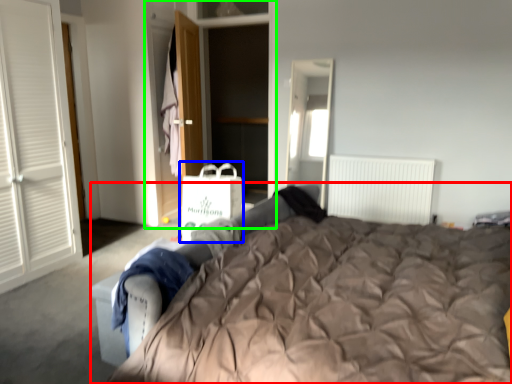
Question: Considering the real-world distances, which object is farthest from bed (highlighted by a red box)? shopping bag (highlighted by a blue box) or armoire (highlighted by a green box)?

Choices:
 (A) shopping bag
 (B) armoire

Answer: (B)